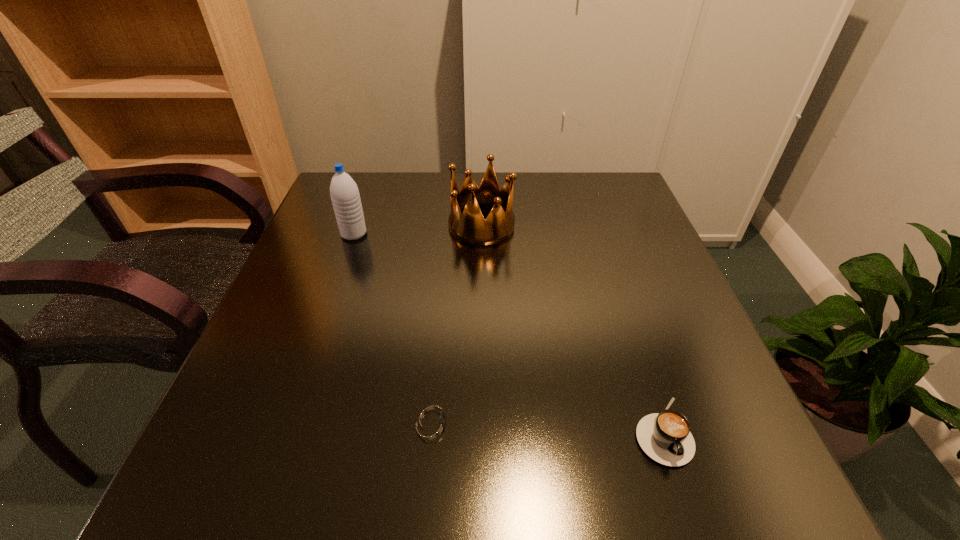
This screenshot has width=960, height=540. In order to click on free area in between the watch and the rightmost object in this screenshot , I will do `click(546, 426)`.

The height and width of the screenshot is (540, 960). I want to click on object that ranks as the second closest to the cappuccino, so click(470, 227).

Where is `object that is the third closest to the watch`? object that is the third closest to the watch is located at coordinates click(344, 193).

Where is `free space that satisfies the following two spatial constraints: 1. on the front side of the second tallest object; 2. on the face of the shortest object`? The image size is (960, 540). free space that satisfies the following two spatial constraints: 1. on the front side of the second tallest object; 2. on the face of the shortest object is located at coordinates (483, 422).